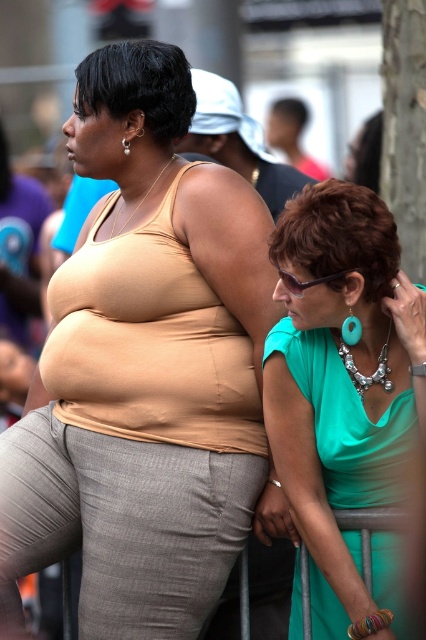
You are a fashion designer observing two items in the image. The first is the matte beige tank top at center and the second is the metallic gray rail at lower center. Which item has a bigger size?

The matte beige tank top at center has a larger size compared to the metallic gray rail at lower center.

You are a photographer setting up a shot and want to ensure that both the metallic gray rail at lower center and the silver metallic earring at upper left are in focus. Based on their positions, which one is closer to the camera?

The silver metallic earring at upper left is closer to the camera than the metallic gray rail at lower center because it is positioned above it.

You are a photographer trying to focus on the woman on the right in the teal dress. There is a point at coordinates point (146, 372) that you need to check. Is this point located on her clothing or on the other woman?

The point (146, 372) is on the matte beige tank top at center, which belongs to the woman on the left wearing a sleeveless beige top. Therefore, the point is not on the teal dress of the woman on the right but on the other woman.